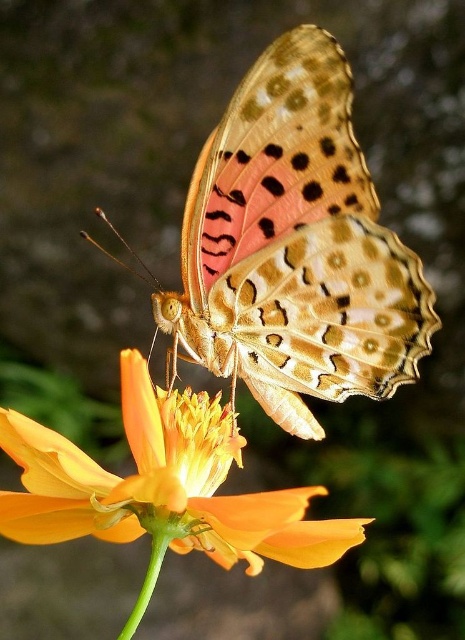
Question: Is spotted orange butterfly at center bigger than orange matte flower at center?

Choices:
 (A) no
 (B) yes

Answer: (B)

Question: Which object appears closest to the camera in this image?

Choices:
 (A) spotted orange butterfly at center
 (B) orange matte flower at center

Answer: (B)

Question: Among these points, which one is nearest to the camera?

Choices:
 (A) (237, 237)
 (B) (319, 550)

Answer: (B)

Question: Which of the following is the closest to the observer?

Choices:
 (A) (157, 512)
 (B) (211, 262)

Answer: (A)

Question: Is spotted orange butterfly at center wider than orange matte flower at center?

Choices:
 (A) no
 (B) yes

Answer: (B)

Question: Is spotted orange butterfly at center to the right of orange matte flower at center from the viewer's perspective?

Choices:
 (A) no
 (B) yes

Answer: (B)